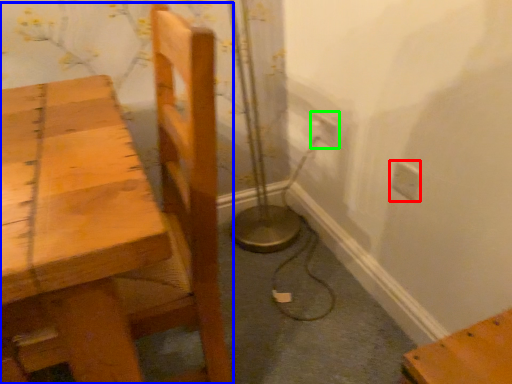
Question: Which object is the closest to the electric outlet (highlighted by a red box)? Choose among these: chair (highlighted by a blue box) or electric outlet (highlighted by a green box).

Choices:
 (A) chair
 (B) electric outlet

Answer: (B)